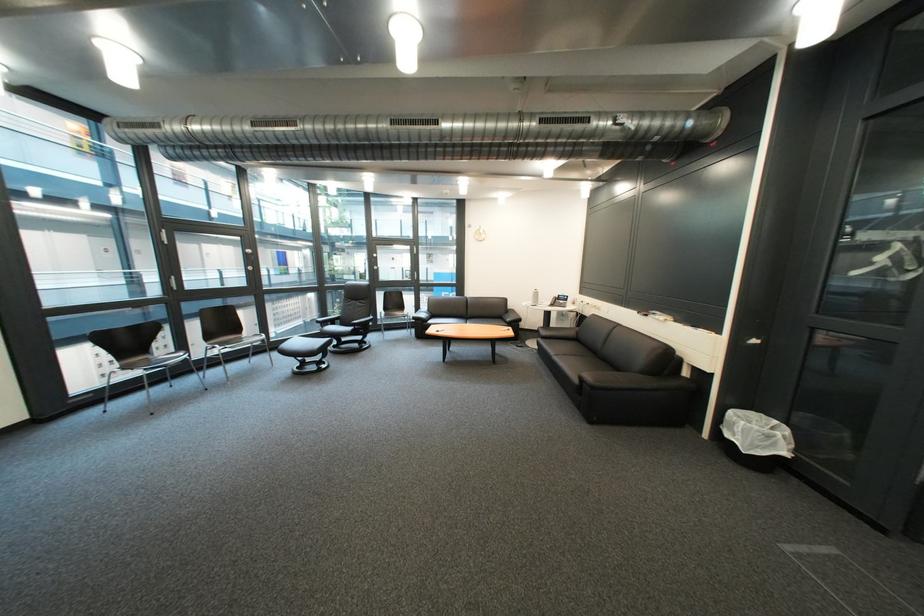
Identify the location of metal door handle. This screenshot has width=924, height=616. (179, 257).